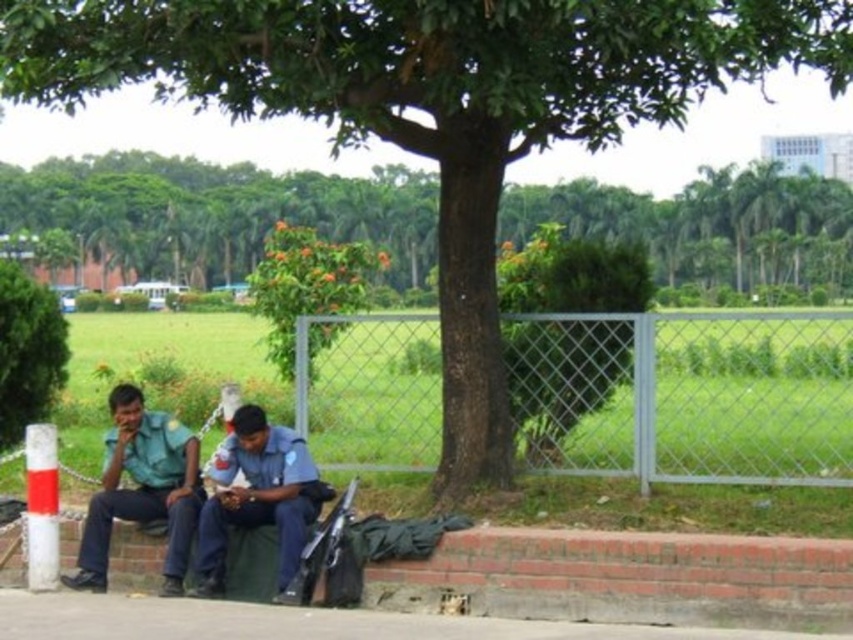
You are standing in the park scene and want to place a small potted plant between the brick at lower left and the gray concrete pavement at lower center. Considering their heights, which object should the plant be placed closer to?

The brick at lower left is much taller than the gray concrete pavement at lower center, so the plant should be placed closer to the gray concrete pavement at lower center to ensure stability and visibility.

You are a photographer trying to capture a photo of the blue uniform at center and the green leafy tree at upper center. Which object would appear larger in the photo?

The green leafy tree at upper center would appear larger in the photo since it is bigger than the blue uniform at center.